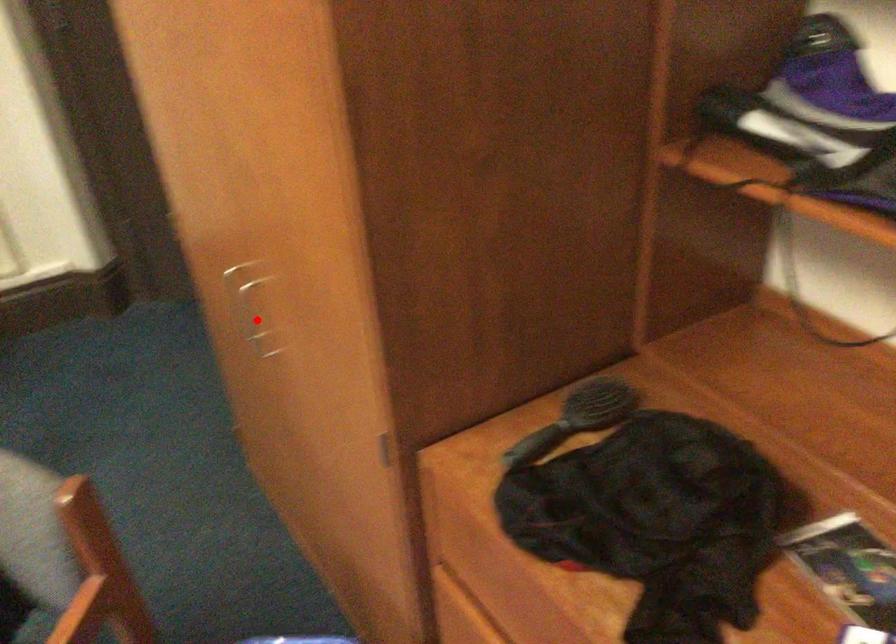
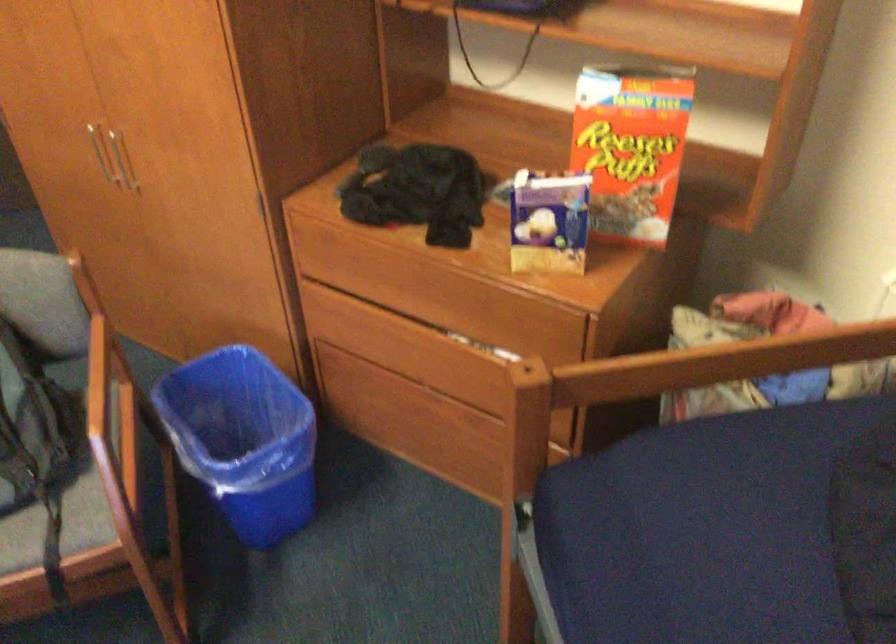
Question: I am providing you with two images of the same scene from different viewpoints. Given a red point in image1, look at the same physical point in image2. Is it:

Choices:
 (A) Closer to the viewpoint
 (B) Farther from the viewpoint

Answer: (B)